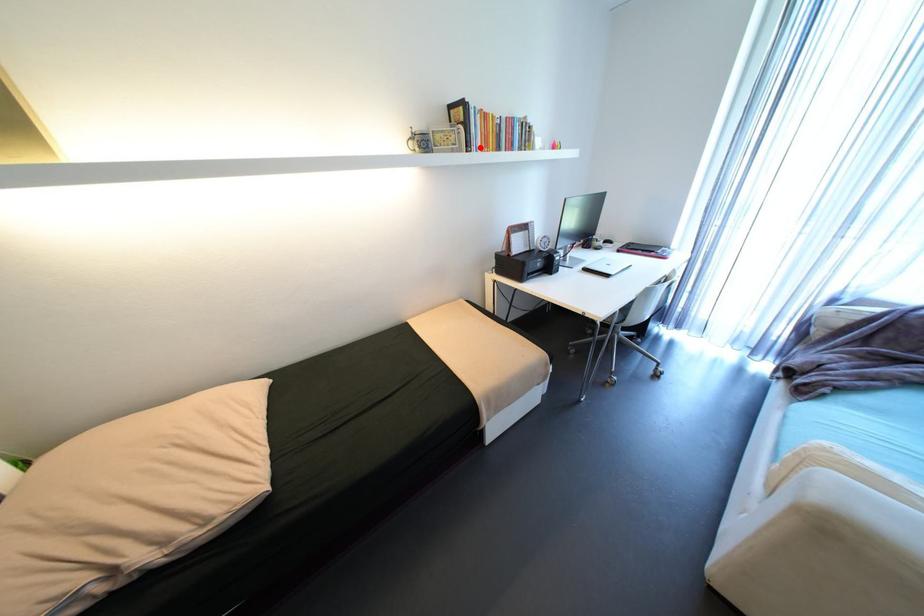
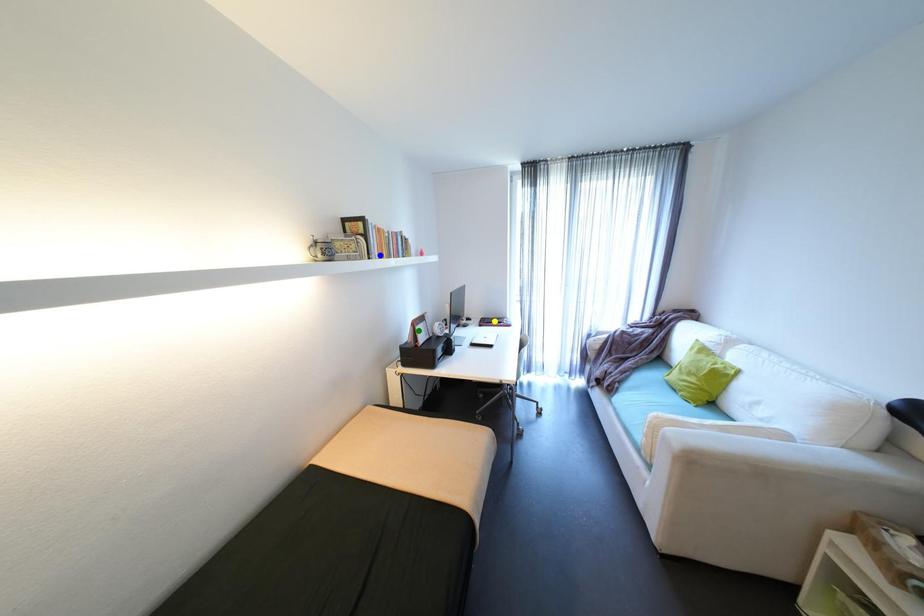
Question: I am providing you with two images of the same scene from different viewpoints. A red point is marked on the first image. You are given multiple points on the second image. Which point in image 2 is actually the same real-world point as the red point in image 1?

Choices:
 (A) green point
 (B) blue point
 (C) yellow point

Answer: (B)